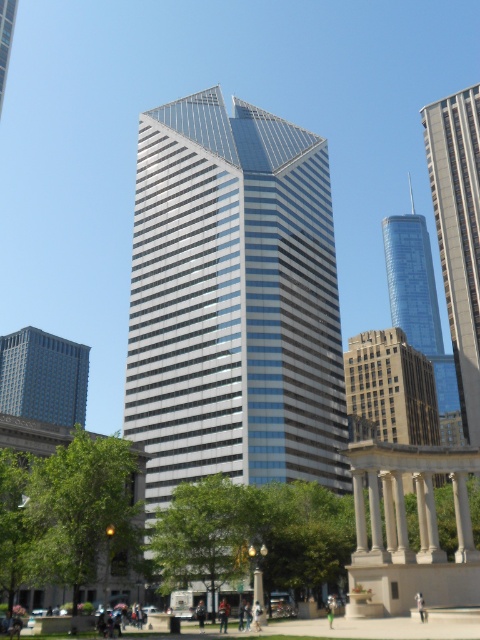
Is glassy steel skyscraper at center to the left of green leafy tree at lower left from the viewer's perspective?

In fact, glassy steel skyscraper at center is to the right of green leafy tree at lower left.

Between point (186, 257) and point (71, 540), which one is positioned behind?

The point (186, 257) is more distant.

Where is `glassy steel skyscraper at center`? This screenshot has width=480, height=640. glassy steel skyscraper at center is located at coordinates (232, 300).

Does point (240, 461) lie behind point (73, 365)?

No, (240, 461) is closer to viewer.

Can you confirm if glassy steel skyscraper at center is bigger than matte glass skyscraper at center?

Yes, glassy steel skyscraper at center is bigger than matte glass skyscraper at center.

Who is more forward, (179, 268) or (22, 408)?

Point (179, 268)

This screenshot has height=640, width=480. In order to click on glassy steel skyscraper at center in this screenshot , I will do `click(232, 300)`.

Does blue glass skyscraper at center appear over matte glass skyscraper at center?

Yes.

Is blue glass skyscraper at center to the left of matte glass skyscraper at center from the viewer's perspective?

No, blue glass skyscraper at center is not to the left of matte glass skyscraper at center.

The height and width of the screenshot is (640, 480). Describe the element at coordinates (418, 298) in the screenshot. I see `blue glass skyscraper at center` at that location.

This screenshot has height=640, width=480. I want to click on blue glass skyscraper at center, so click(x=418, y=298).